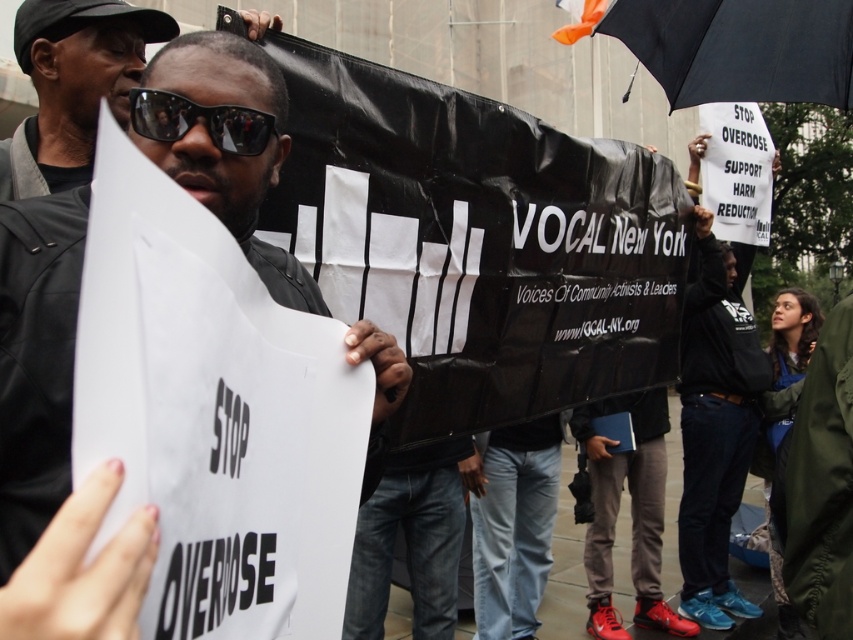
You are a photographer at the protest scene. You want to take a photo that includes both the man with the sign and the VOCAL New York banner. The man with the sign is located at point (16, 561) and the banner is at point (276, 125). Based on their positions, which object should you focus on first to ensure both are in frame?

Point (16, 561) is in front of point (276, 125), so you should focus on the man with the sign at point (16, 561) first to ensure both are in frame.